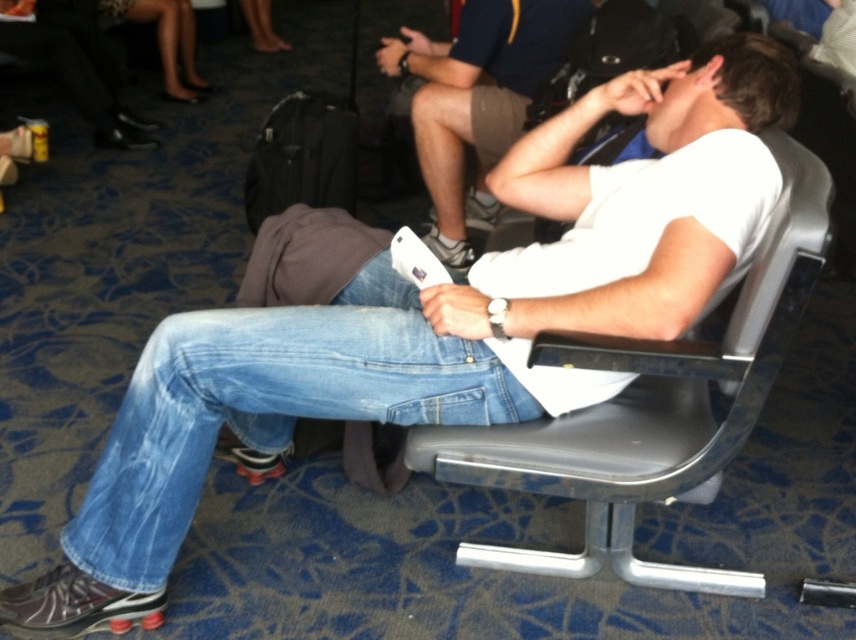
You are standing in the airport waiting area and see the denim at center and the metallic gray chair at center. Which object is positioned to the left?

The denim at center is positioned to the left of the metallic gray chair at center.

Consider the image. You are standing in the airport waiting area and see the denim at center and the metallic gray chair at center. Which object is closer to you?

The denim at center is closer to you than the metallic gray chair at center.